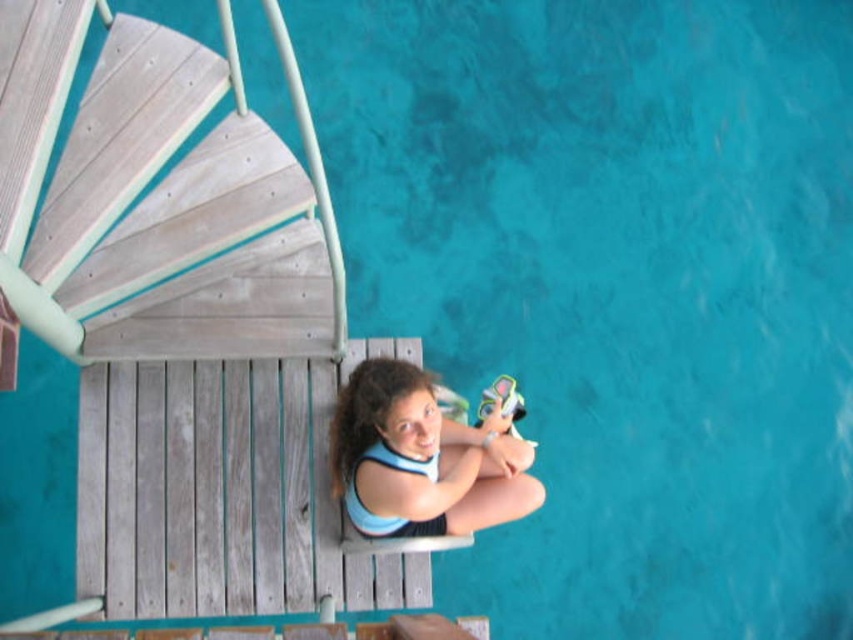
You are standing at the top of the light gray wood stairs at upper left and want to reach the blue fabric girl at center. Which direction should you move to get closer to her?

Since the light gray wood stairs at upper left are closer to the viewer than the blue fabric girl at center, you should move downward or away from the stairs to reach her.

You are standing at the edge of the wooden dock and want to climb up the light gray wood stairs at upper left. If your reach is 2 meters, can you touch the stairs without moving closer?

The light gray wood stairs at upper left are 2.22 meters away from the viewer, which is beyond your 2 meter reach. You cannot touch the stairs without moving closer.

You are a photographer trying to capture a shot of the blue fabric girl at center from the light gray wood stairs at upper left. Can you see her head from your position on the stairs?

The light gray wood stairs at upper left is taller than blue fabric girl at center, so yes, you can see her head from the stairs.